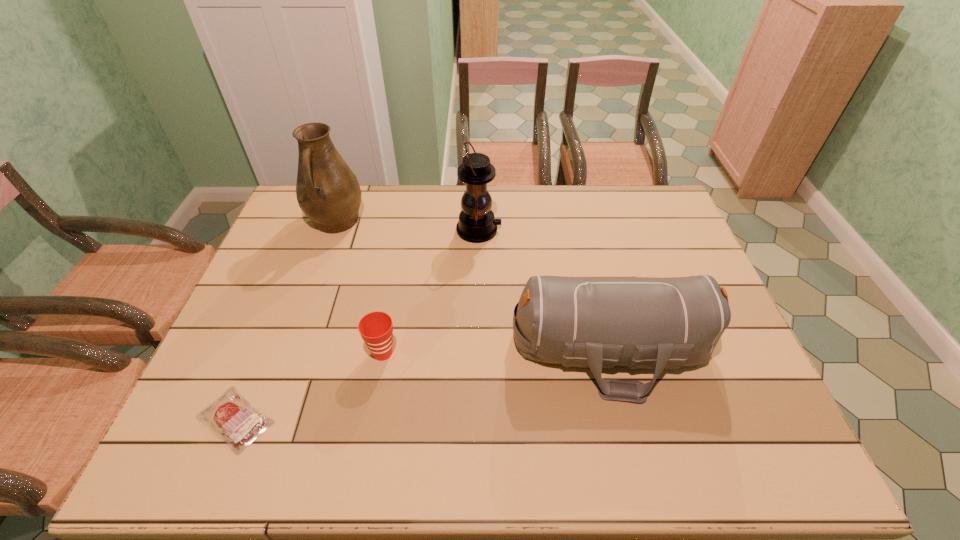
At what (x,y) coordinates should I click in order to perform the action: click on vacant space at the far edge of the desktop. Please return your answer as a coordinate pair (x, y). Looking at the image, I should click on tap(532, 188).

This screenshot has height=540, width=960. Identify the location of free space at the near edge of the desktop. (253, 450).

Where is `vacant space at the left edge`? Image resolution: width=960 pixels, height=540 pixels. vacant space at the left edge is located at coordinates (299, 227).

At what (x,y) coordinates should I click in order to perform the action: click on free space at the right edge. Please return your answer as a coordinate pair (x, y). The height and width of the screenshot is (540, 960). Looking at the image, I should click on (647, 246).

Where is `vacant space at the far left corner of the desktop`? The height and width of the screenshot is (540, 960). vacant space at the far left corner of the desktop is located at coordinates (296, 206).

Where is `empty location between the shortest object and the rightmost object`? The height and width of the screenshot is (540, 960). empty location between the shortest object and the rightmost object is located at coordinates (423, 384).

The width and height of the screenshot is (960, 540). I want to click on empty space that is in between the third tallest object and the steak, so click(x=423, y=384).

Locate an element on the screen. This screenshot has width=960, height=540. empty location between the shortest object and the second object from right to left is located at coordinates (357, 325).

Locate an element on the screen. The image size is (960, 540). vacant space in between the third object from left to right and the lantern is located at coordinates (431, 292).

Find the location of a particular element. This screenshot has height=540, width=960. blank region between the duffel bag and the shortest object is located at coordinates (423, 384).